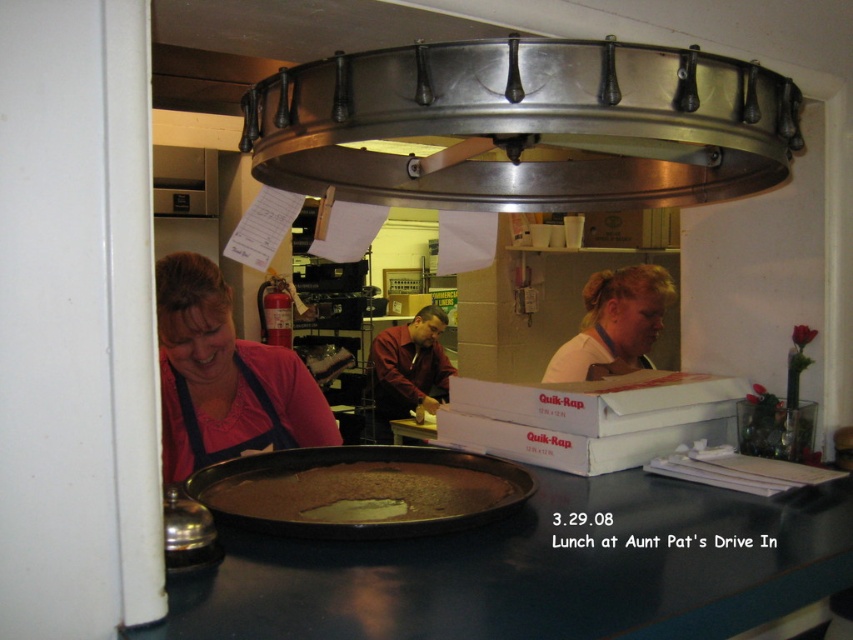
You are a customer at Aunt Pat s Drive In and you notice two items in the kitchen area. One is the matte pink shirt at lower left and the other is the brown matte pizza at center. Which item is narrower in width?

The matte pink shirt at lower left is thinner than the brown matte pizza at center, so the matte pink shirt at lower left is narrower in width.

You are a delivery person standing outside the restaurant looking through the doorway. You see a point marked at coordinates (534,570). What object is located at that point?

The point at coordinates (534,570) indicates the black glossy counter top at center.